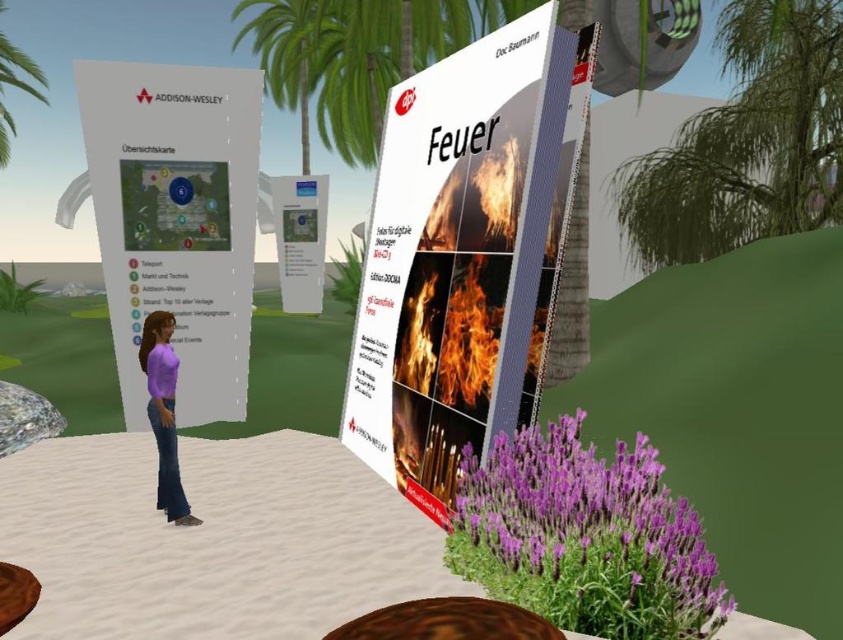
Who is lower down, white glossy sign at center or matte purple shirt at center?

matte purple shirt at center is lower down.

Is white glossy sign at center below matte purple shirt at center?

Actually, white glossy sign at center is above matte purple shirt at center.

Is point (299, 289) farther from viewer compared to point (165, 356)?

That is True.

Identify the location of white glossy sign at center. 299,240.

Does white paper map at left have a smaller size compared to green leafy palm tree at upper left?

Correct, white paper map at left occupies less space than green leafy palm tree at upper left.

Does point (121, 108) come behind point (19, 74)?

No, it is in front of (19, 74).

Locate an element on the screen. The width and height of the screenshot is (843, 640). white paper map at left is located at coordinates (175, 220).

Does white glossy sign at center have a larger size compared to green leafy palm tree at upper left?

No.

Does white glossy sign at center have a lesser width compared to green leafy palm tree at upper left?

Yes.

This screenshot has width=843, height=640. What are the coordinates of `white glossy sign at center` in the screenshot? It's located at (299, 240).

Identify the location of white glossy sign at center. (299, 240).